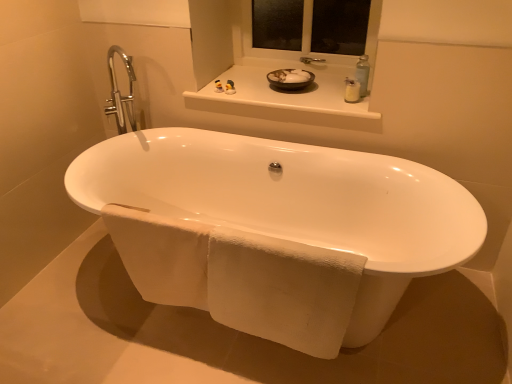
Locate an element on the screen. free space above white glossy window sill at upper center (from a real-world perspective) is located at coordinates (284, 92).